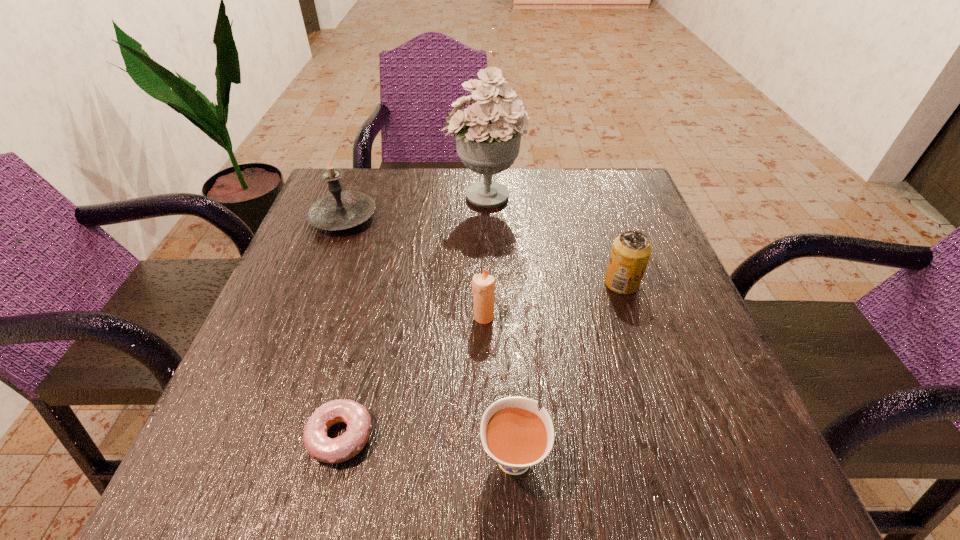
The height and width of the screenshot is (540, 960). I want to click on free location located 0.370m on the front of the farther candle, so click(281, 382).

Find the location of a particular element. free space located 0.050m on the front of the right candle is located at coordinates (484, 348).

Identify the location of blank area located on the left of the beer can. This screenshot has height=540, width=960. (408, 283).

Identify the location of free spot located 0.380m on the side of the fifth tallest object with the handle. click(502, 253).

I want to click on blank area located 0.320m on the side of the fifth tallest object with the handle, so click(x=504, y=273).

This screenshot has height=540, width=960. I want to click on free spot located 0.090m on the side of the fifth tallest object with the handle, so click(x=509, y=368).

Locate an element on the screen. The width and height of the screenshot is (960, 540). free space located on the left of the doughnut is located at coordinates (248, 436).

Image resolution: width=960 pixels, height=540 pixels. Identify the location of bouquet that is at the far edge. (488, 135).

Locate an element on the screen. This screenshot has height=540, width=960. candle that is positioned at the far edge is located at coordinates (338, 210).

Image resolution: width=960 pixels, height=540 pixels. I want to click on teacup located in the near edge section of the desktop, so click(513, 433).